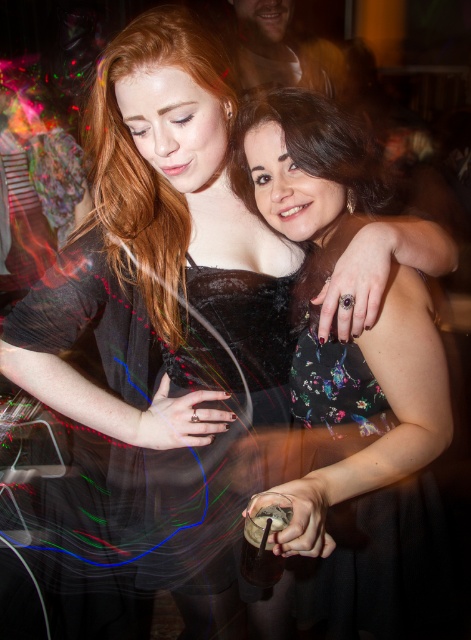
From the picture: Between black floral dress at center and black sheer dress at center, which one has less height?

black sheer dress at center is shorter.

Identify the location of black floral dress at center. Image resolution: width=471 pixels, height=640 pixels. [355, 378].

Identify the location of black floral dress at center. The height and width of the screenshot is (640, 471). (355, 378).